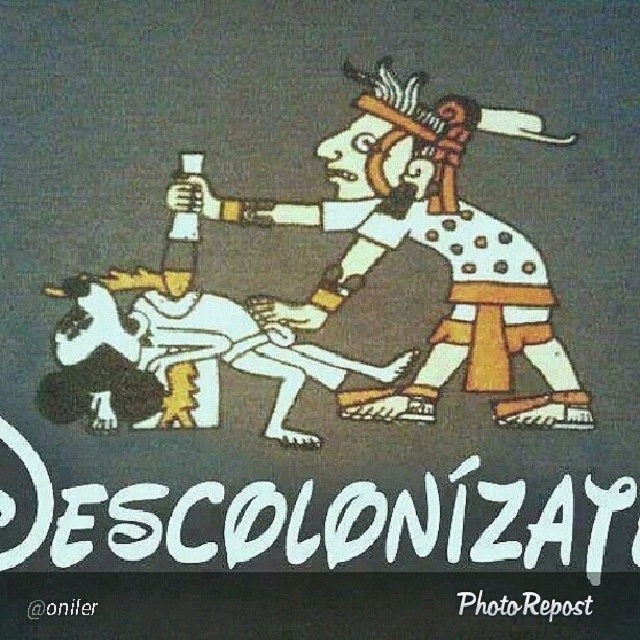
You are an artist who wants to create a new poster. You have two elements to place on the canvas. The white paper text at center and the black paper at lower left. Based on the original image, which element should you make larger in your design?

The white paper text at center should be made larger because it is much taller than the black paper at lower left in the original image.

You are an artist analyzing this image. You notice the white paper text at center and the black paper at lower left. Which object is closer to the viewer?

The white paper text at center is closer to the viewer because the black paper at lower left is behind it.